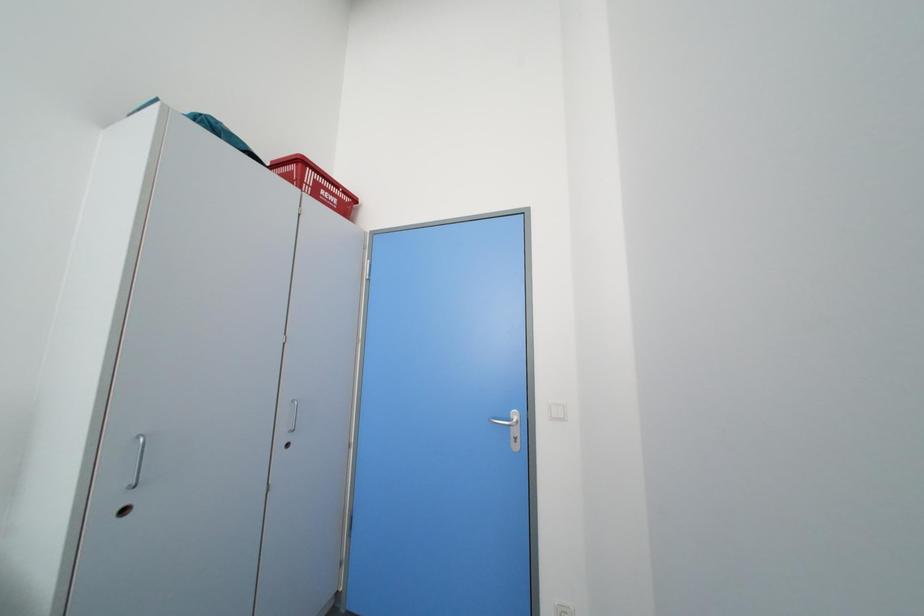
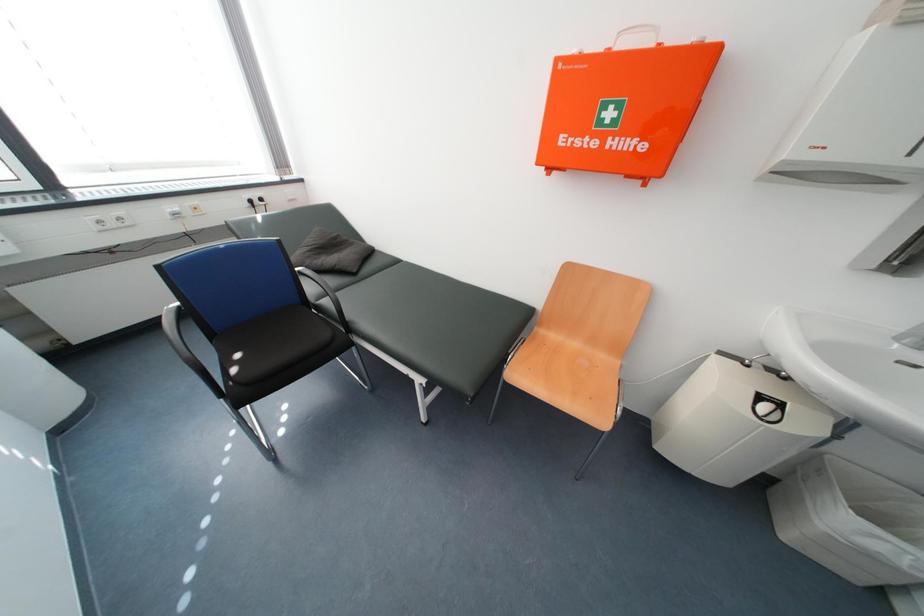
How did the camera likely rotate?

The camera rotated toward left-down.